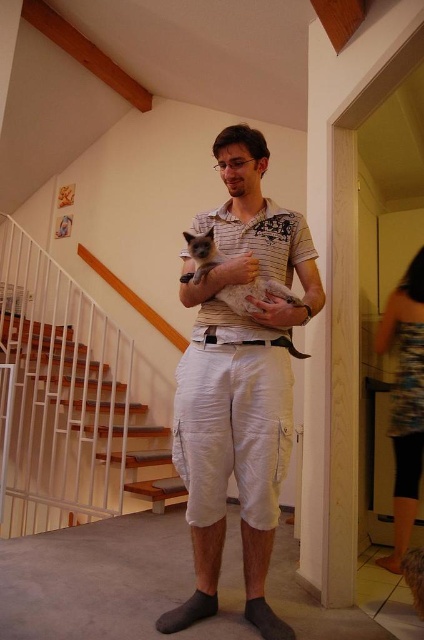
Who is positioned more to the right, white cotton pants at center or wooden stairs at lower left?

white cotton pants at center

Is point (276, 404) positioned in front of point (52, 339)?

Yes, it is.

Find the location of a particular element. Image resolution: width=424 pixels, height=640 pixels. white cotton pants at center is located at coordinates (239, 381).

Between point (36, 387) and point (251, 301), which one is positioned in front?

Point (251, 301) is more forward.

Is point (113, 484) farther from camera compared to point (184, 234)?

Yes, point (113, 484) is behind point (184, 234).

Locate an element on the screen. wooden stairs at lower left is located at coordinates (77, 417).

Does white cotton pants at center appear on the left side of silvery fur cat at center?

Correct, you'll find white cotton pants at center to the left of silvery fur cat at center.

Is white cotton pants at center positioned behind silvery fur cat at center?

No, white cotton pants at center is closer to the viewer.

The height and width of the screenshot is (640, 424). Find the location of `white cotton pants at center`. white cotton pants at center is located at coordinates (239, 381).

The image size is (424, 640). What are the coordinates of `white cotton pants at center` in the screenshot? It's located at (239, 381).